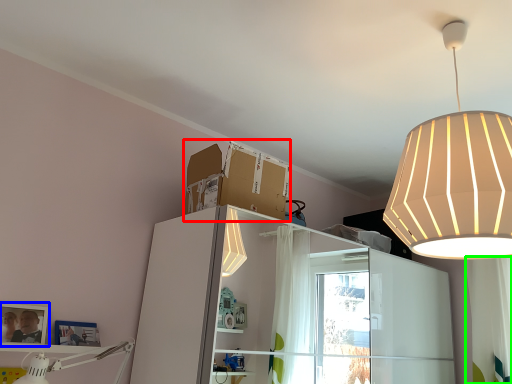
Question: Estimate the real-world distances between objects in this image. Which object is closer to cardboard box (highlighted by a red box), picture frame (highlighted by a blue box) or curtain (highlighted by a green box)?

Choices:
 (A) picture frame
 (B) curtain

Answer: (A)